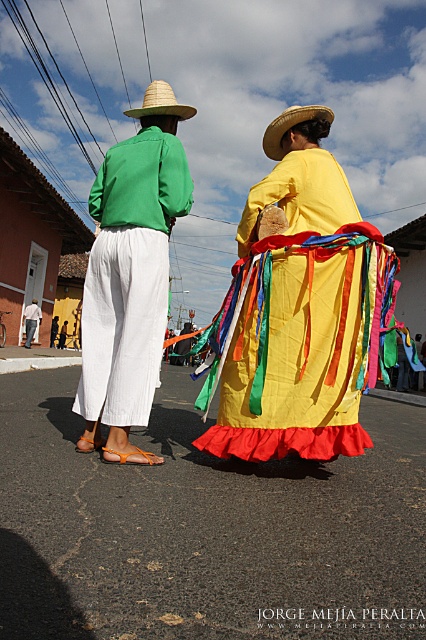
Question: Does yellow satin dress at center have a larger size compared to matte green shirt at center?

Choices:
 (A) no
 (B) yes

Answer: (B)

Question: Which of these objects is positioned closest to the yellow satin dress at center?

Choices:
 (A) green cotton shirt at left
 (B) matte green shirt at center
 (C) straw woven hat at upper center
 (D) straw woven cowboy hat at back

Answer: (A)

Question: From the image, what is the correct spatial relationship of straw woven cowboy hat at back in relation to straw woven hat at upper center?

Choices:
 (A) above
 (B) below

Answer: (B)

Question: Which point is farther from the camera taking this photo?

Choices:
 (A) (25, 323)
 (B) (124, 115)
 (C) (273, 138)
 (D) (226, 378)

Answer: (B)

Question: Is yellow satin dress at center below green cotton shirt at left?

Choices:
 (A) yes
 (B) no

Answer: (A)

Question: Which object is positioned farthest from the matte green shirt at center?

Choices:
 (A) yellow satin dress at center
 (B) straw woven cowboy hat at back
 (C) green cotton shirt at left
 (D) straw woven hat at upper center

Answer: (A)